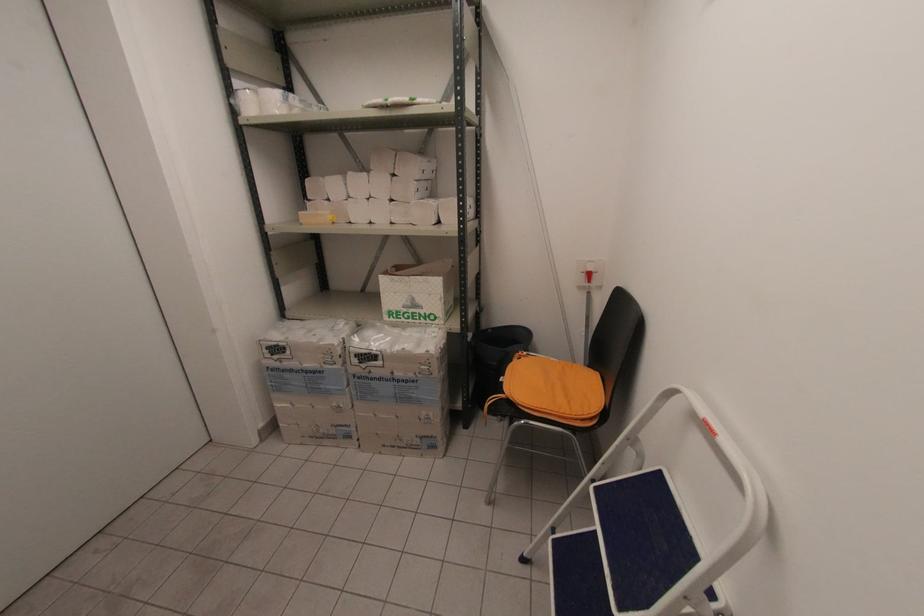
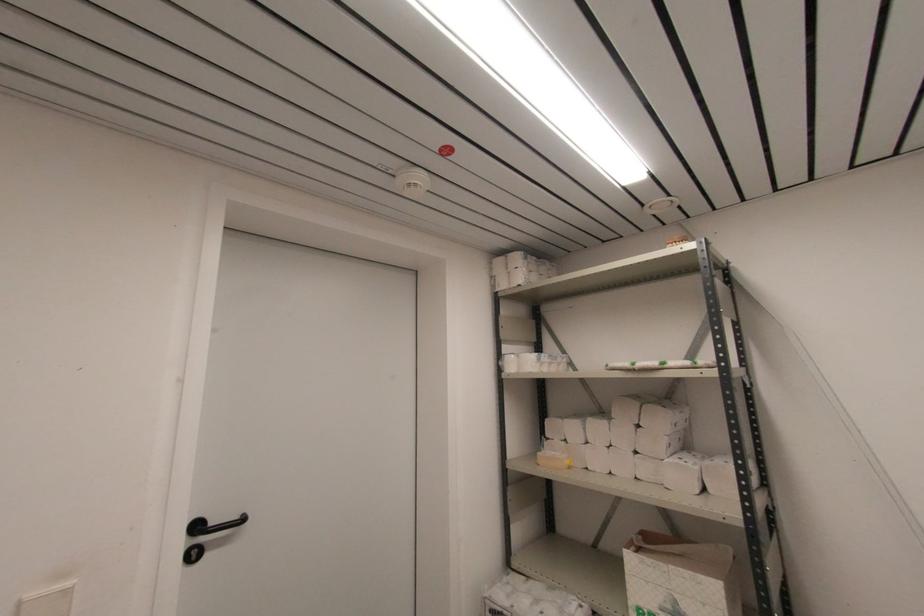
In the second image, find the point that corresponds to pixel 236 89 in the first image.

(504, 354)